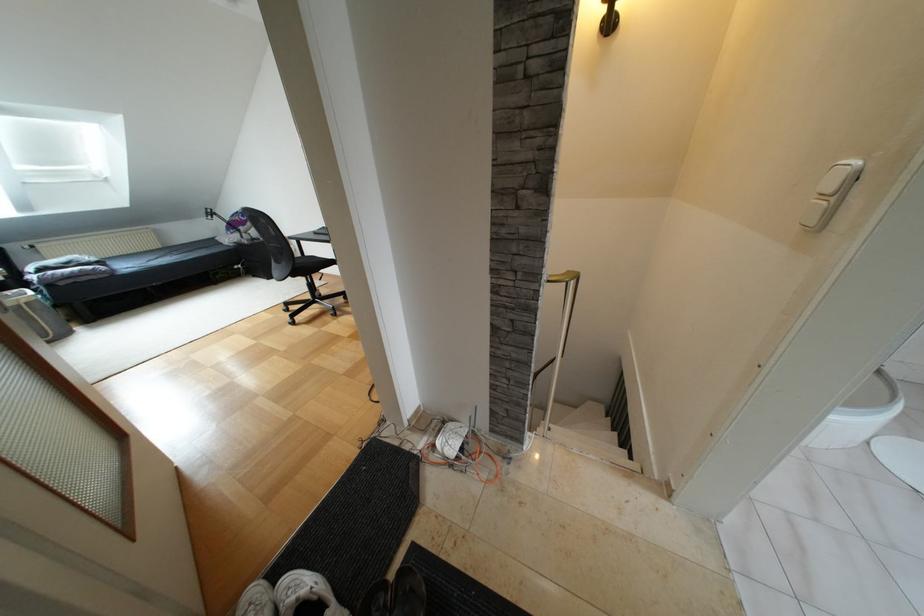
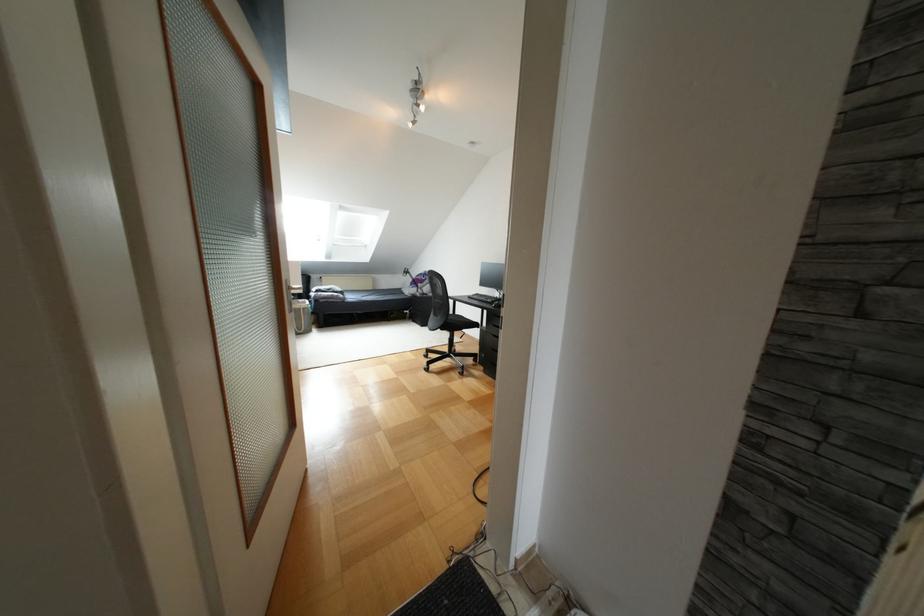
In the second image, find the point that corresponds to pixel 314 233 in the first image.

(468, 297)